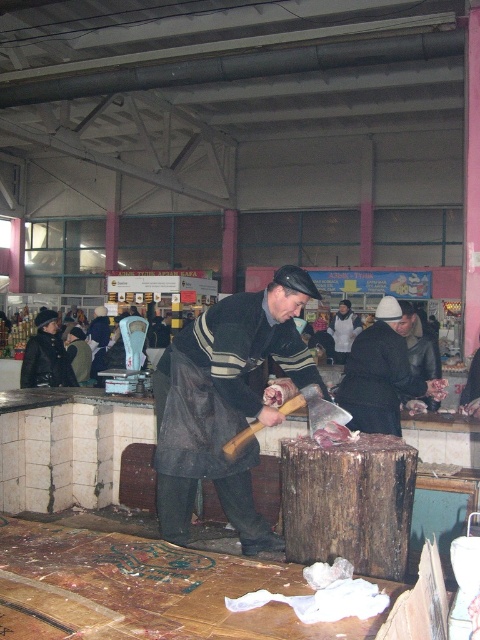
You are a customer at the meat market and need to determine which item is larger between the dark gray woolen coat at center and the meat raw at center. Which one is bigger?

The dark gray woolen coat at center is bigger than the meat raw at center.

You are standing at the entrance of the market and want to take a photo of the two points in the image. Which point, point [176,536] or point [324,445], is closer to your camera?

Point [176,536] is further to the camera than point [324,445], so the point closer to the camera is point [324,445].

You are standing in the meat market and want to place two items on the floor. The first item is at point (x=323, y=442) and the second item is at point (x=437, y=400). Which item is closer to you?

The item at point (x=323, y=442) is closer to you than the item at point (x=437, y=400).